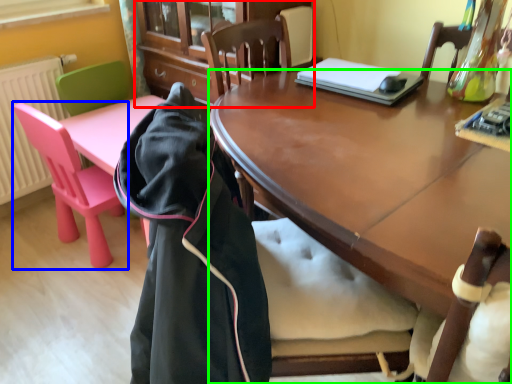
Question: Which object is positioned farthest from cabinetry (highlighted by a red box)? Select from chair (highlighted by a blue box) and desk (highlighted by a green box).

Choices:
 (A) chair
 (B) desk

Answer: (B)